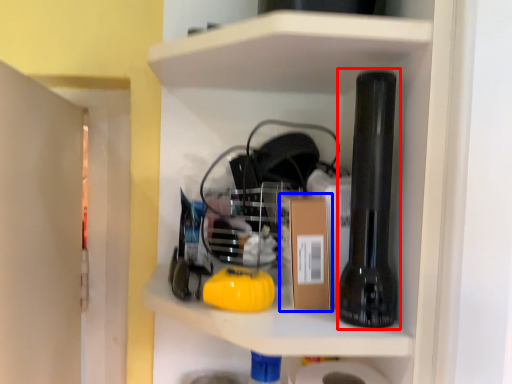
Question: Which object appears closest to the camera in this image, beer bottle (highlighted by a red box) or cardboard box (highlighted by a blue box)?

Choices:
 (A) beer bottle
 (B) cardboard box

Answer: (A)